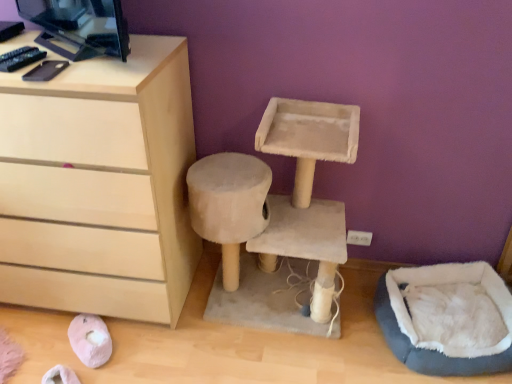
Question: From the image's perspective, is light wood chest of drawers at left positioned above or below black glossy desktop computer at upper left?

Choices:
 (A) above
 (B) below

Answer: (B)

Question: Do you think light wood chest of drawers at left is within black glossy desktop computer at upper left, or outside of it?

Choices:
 (A) inside
 (B) outside

Answer: (B)

Question: Based on their relative distances, which object is farther from the black glossy desktop computer at upper left?

Choices:
 (A) light wood chest of drawers at left
 (B) blue fuzzy bean bag at lower right
 (C) beige fabric cat tree at center

Answer: (B)

Question: Estimate the real-world distances between objects in this image. Which object is farther from the light wood chest of drawers at left?

Choices:
 (A) blue fuzzy bean bag at lower right
 (B) black glossy desktop computer at upper left
 (C) beige fabric cat tree at center

Answer: (A)